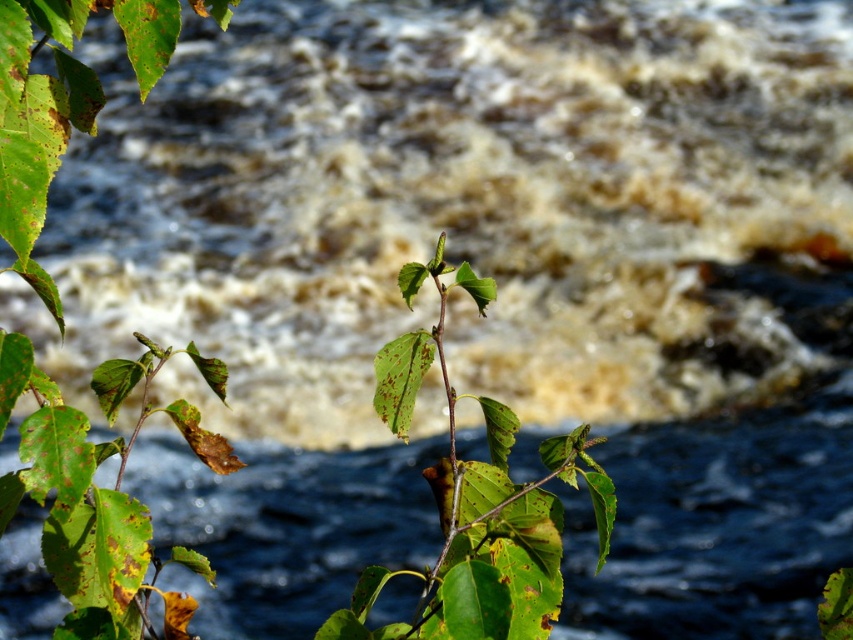
Question: Which object is closer to the camera taking this photo?

Choices:
 (A) green matte leaf at center
 (B) green matte leaves at left

Answer: (B)

Question: In this image, where is green matte leaves at left located relative to green matte leaf at center?

Choices:
 (A) above
 (B) below

Answer: (A)

Question: Which object appears closest to the camera in this image?

Choices:
 (A) green matte leaves at left
 (B) green matte leaf at center

Answer: (A)

Question: Is green matte leaves at left to the right of green matte leaf at center from the viewer's perspective?

Choices:
 (A) yes
 (B) no

Answer: (B)

Question: Is green matte leaves at left further to the viewer compared to green matte leaf at center?

Choices:
 (A) yes
 (B) no

Answer: (B)

Question: Which object appears farthest from the camera in this image?

Choices:
 (A) green matte leaf at center
 (B) green matte leaves at left

Answer: (A)